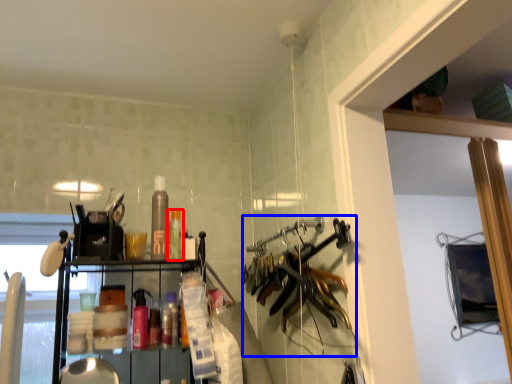
Question: Among these objects, which one is farthest to the camera, bottle (highlighted by a red box) or hanger (highlighted by a blue box)?

Choices:
 (A) bottle
 (B) hanger

Answer: (A)